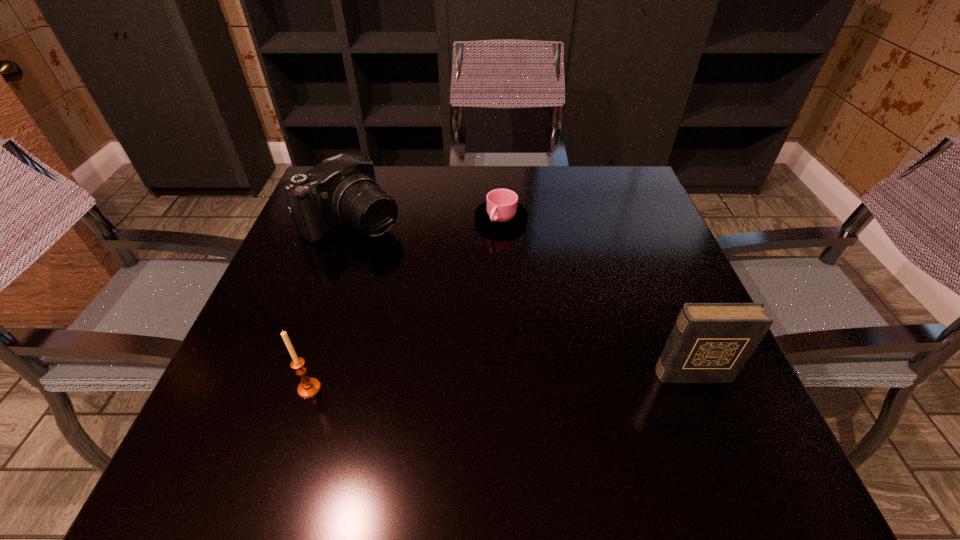
Where is `free spot located 0.370m on the side with the handle of the third object from left to right`? free spot located 0.370m on the side with the handle of the third object from left to right is located at coordinates (475, 362).

Where is `free spot located 0.290m on the side with the handle of the third object from left to right`? Image resolution: width=960 pixels, height=540 pixels. free spot located 0.290m on the side with the handle of the third object from left to right is located at coordinates (481, 328).

At what (x,y) coordinates should I click in order to perform the action: click on blank area located on the side with the handle of the third object from left to right. Please return your answer as a coordinate pair (x, y). Looking at the image, I should click on (475, 362).

Where is `camera at the far edge`? Image resolution: width=960 pixels, height=540 pixels. camera at the far edge is located at coordinates (342, 189).

Where is `cup located in the far edge section of the desktop`? cup located in the far edge section of the desktop is located at coordinates (501, 212).

The height and width of the screenshot is (540, 960). I want to click on candle_holder at the near edge, so click(309, 387).

Image resolution: width=960 pixels, height=540 pixels. Identify the location of diary positioned at the near edge. (710, 342).

You are a GUI agent. You are given a task and a screenshot of the screen. Output one action in this format:
    pyautogui.click(x=<x>, y=<y>)
    Task: Click on the candle_holder that is at the left edge
    The height and width of the screenshot is (540, 960).
    Given the screenshot: What is the action you would take?
    pyautogui.click(x=309, y=387)

I want to click on camera that is at the left edge, so point(342,189).

I want to click on object located at the right edge, so [x=710, y=342].